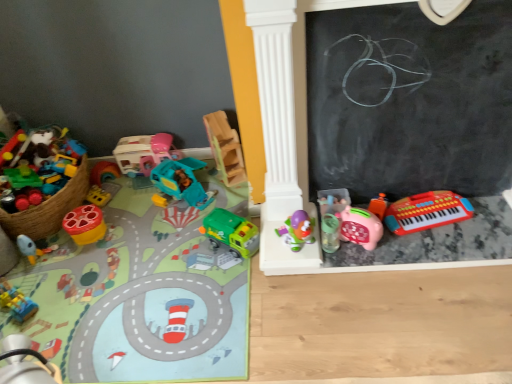
At what (x,y) coordinates should I click in order to perform the action: click on free area in between wooden blocks at center, the sixth toy in the right-to-left sequence, and teal plastic car at center, marked as the 7th toy in a right-to-left arrangement. Please return your answer as a coordinate pair (x, y). The height and width of the screenshot is (384, 512). Looking at the image, I should click on (211, 188).